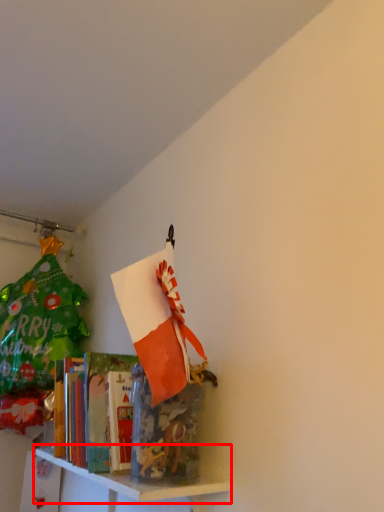
Question: From the image's perspective, what is the correct spatial positioning of shelf (annotated by the red box) in reference to shelf?

Choices:
 (A) above
 (B) below

Answer: (B)